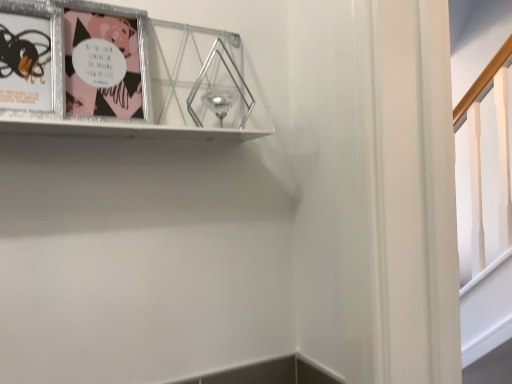
Question: From a real-world perspective, is metallic silver picture frame at upper left, placed as the 3th picture frame when sorted from right to left, positioned above or below metallic silver picture frame at upper left, the 2th picture frame positioned from the right?

Choices:
 (A) below
 (B) above

Answer: (A)

Question: Considering the positions of metallic silver picture frame at upper left, placed as the 3th picture frame when sorted from right to left, and metallic silver picture frame at upper left, the second picture frame when ordered from left to right, in the image, is metallic silver picture frame at upper left, placed as the 3th picture frame when sorted from right to left, bigger or smaller than metallic silver picture frame at upper left, the second picture frame when ordered from left to right,?

Choices:
 (A) big
 (B) small

Answer: (B)

Question: Based on their relative distances, which object is nearer to the metallic silver picture frame at upper left, acting as the first picture frame starting from the right?

Choices:
 (A) metallic silver picture frame at upper left, the 1th picture frame viewed from the left
 (B) metallic silver picture frame at upper left, the second picture frame when ordered from left to right

Answer: (B)

Question: Which object is positioned farthest from the metallic silver picture frame at upper left, the third picture frame from the left?

Choices:
 (A) metallic silver picture frame at upper left, the second picture frame when ordered from left to right
 (B) metallic silver picture frame at upper left, the 1th picture frame viewed from the left

Answer: (B)